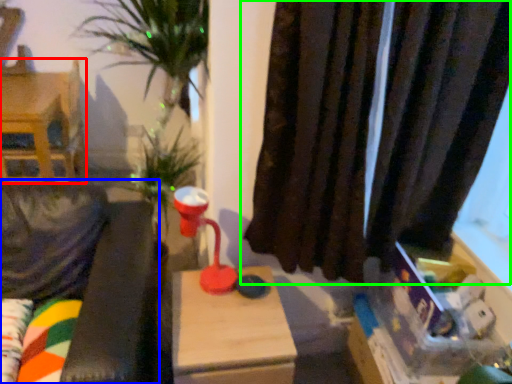
Question: Which is nearer to the furniture (highlighted by a red box)? couch (highlighted by a blue box) or curtain (highlighted by a green box).

Choices:
 (A) couch
 (B) curtain

Answer: (A)